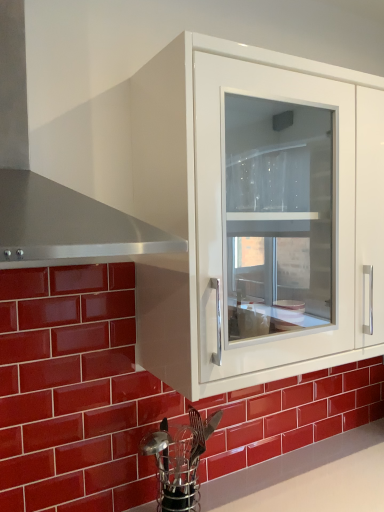
Question: From the image's perspective, would you say glossy ceramic brick at lower left is positioned over white glossy cabinet at upper center?

Choices:
 (A) no
 (B) yes

Answer: (A)

Question: From a real-world perspective, is glossy ceramic brick at lower left under white glossy cabinet at upper center?

Choices:
 (A) no
 (B) yes

Answer: (B)

Question: Is glossy ceramic brick at lower left shorter than white glossy cabinet at upper center?

Choices:
 (A) yes
 (B) no

Answer: (B)

Question: Is white glossy cabinet at upper center completely or partially inside glossy ceramic brick at lower left?

Choices:
 (A) yes
 (B) no

Answer: (B)

Question: Considering the relative positions of glossy ceramic brick at lower left and white glossy cabinet at upper center in the image provided, is glossy ceramic brick at lower left to the left of white glossy cabinet at upper center from the viewer's perspective?

Choices:
 (A) no
 (B) yes

Answer: (B)

Question: Is point (248, 212) positioned closer to the camera than point (21, 203)?

Choices:
 (A) closer
 (B) farther

Answer: (B)

Question: From the image's perspective, is white glossy cabinet at upper center located above or below stainless steel exhaust hood at left?

Choices:
 (A) above
 (B) below

Answer: (B)

Question: In the image, is white glossy cabinet at upper center on the left side or the right side of stainless steel exhaust hood at left?

Choices:
 (A) right
 (B) left

Answer: (A)

Question: In terms of width, does white glossy cabinet at upper center look wider or thinner when compared to stainless steel exhaust hood at left?

Choices:
 (A) thin
 (B) wide

Answer: (A)

Question: In terms of size, does stainless steel exhaust hood at left appear bigger or smaller than white glossy cabinet at upper center?

Choices:
 (A) small
 (B) big

Answer: (A)

Question: Would you say stainless steel exhaust hood at left is to the left or to the right of white glossy cabinet at upper center in the picture?

Choices:
 (A) left
 (B) right

Answer: (A)

Question: Is stainless steel exhaust hood at left taller or shorter than white glossy cabinet at upper center?

Choices:
 (A) short
 (B) tall

Answer: (A)

Question: Choose the correct answer: Is stainless steel exhaust hood at left inside white glossy cabinet at upper center or outside it?

Choices:
 (A) inside
 (B) outside

Answer: (B)

Question: Is metallic silver utensil holder at lower center wider or thinner than stainless steel exhaust hood at left?

Choices:
 (A) thin
 (B) wide

Answer: (A)

Question: Considering the positions of point (152, 448) and point (18, 254), is point (152, 448) closer or farther from the camera than point (18, 254)?

Choices:
 (A) closer
 (B) farther

Answer: (B)